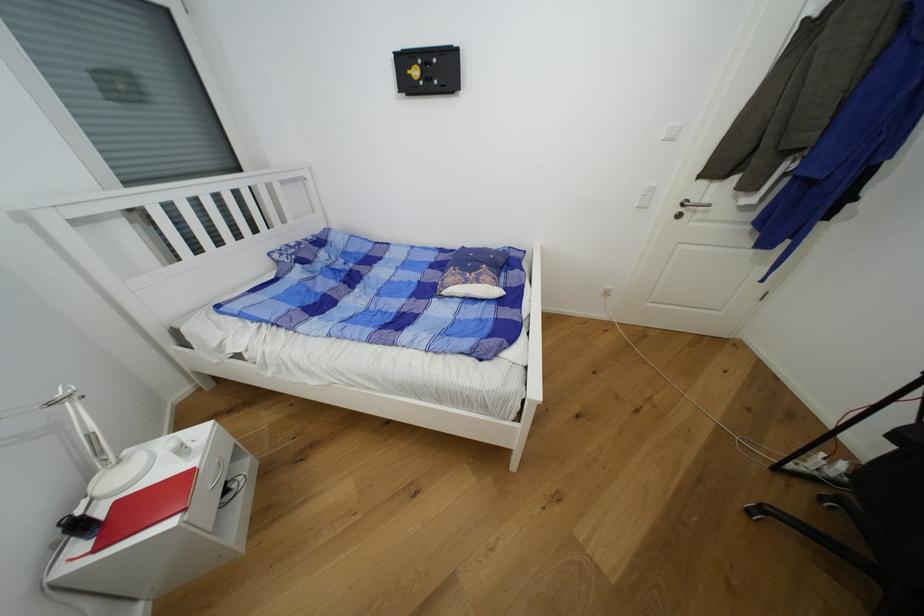
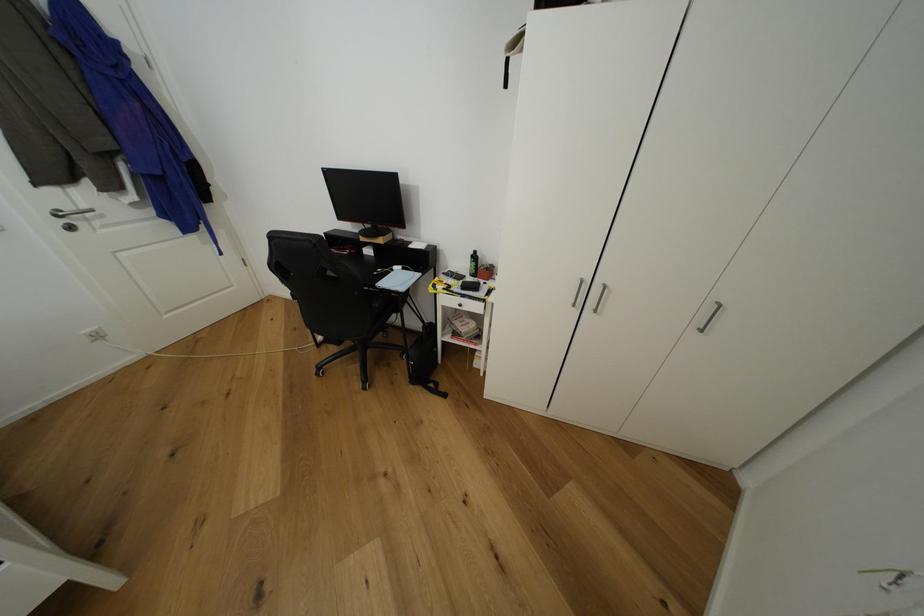
How did the camera likely rotate?

The camera rotated toward right-down.